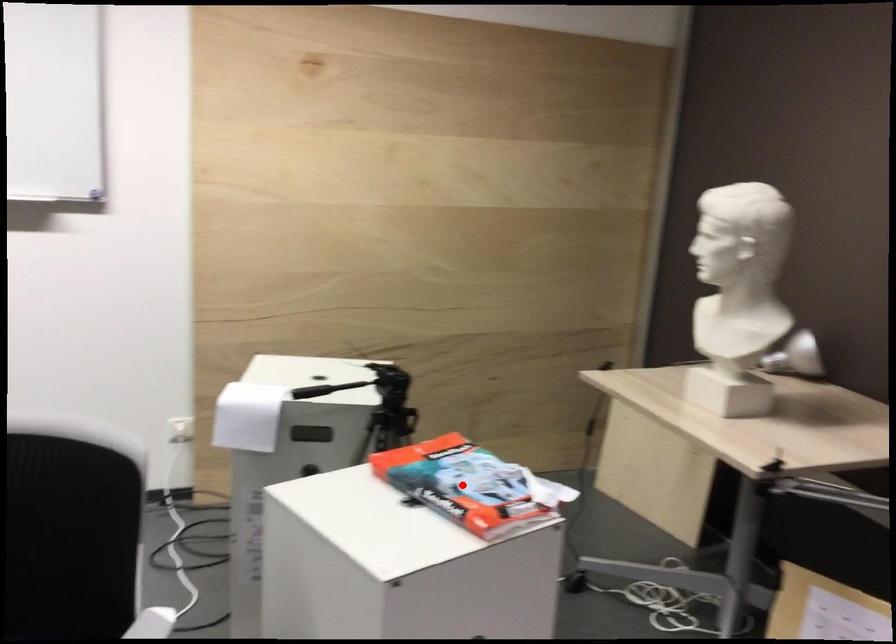
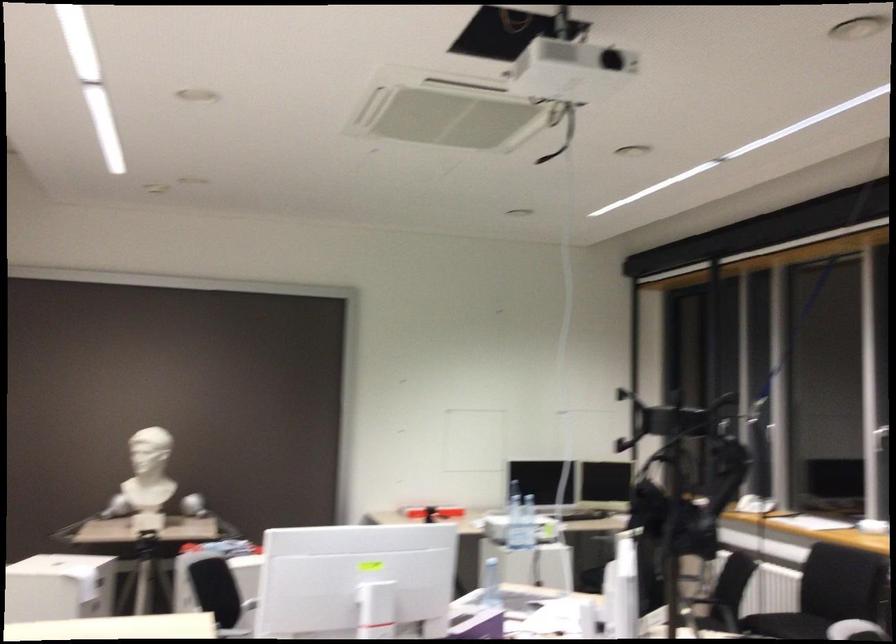
Question: I am providing you with two images of the same scene from different viewpoints. A red point is marked on the first image. Is the red point's position out of view in image 2?

Choices:
 (A) Yes
 (B) No

Answer: (A)